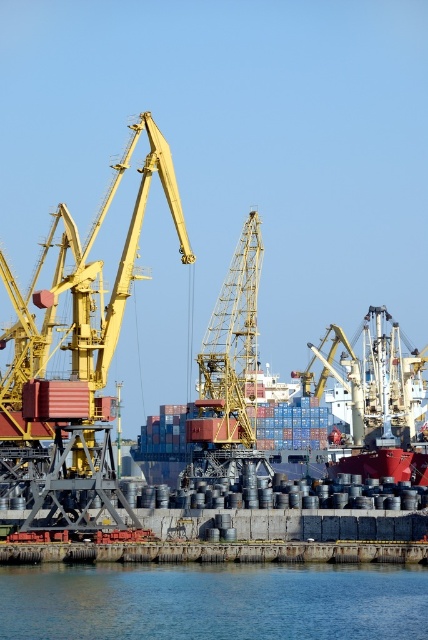
How distant is blue liquid water at lower center from yellow metallic crane at center?

They are 99.69 meters apart.

Who is taller, blue liquid water at lower center or yellow metallic crane at center?

yellow metallic crane at center is taller.

You are a GUI agent. You are given a task and a screenshot of the screen. Output one action in this format:
    pyautogui.click(x=<x>, y=<y>)
    Task: Click on the blue liquid water at lower center
    This screenshot has height=640, width=428.
    Given the screenshot: What is the action you would take?
    click(x=213, y=602)

Who is more distant from viewer, (397, 408) or (199, 388)?

Point (397, 408)

Can you confirm if red matte container ship at center is taller than yellow metallic crane at center?

No, red matte container ship at center is not taller than yellow metallic crane at center.

Which is in front, point (184, 436) or point (250, 269)?

Point (250, 269) is more forward.

Where is `red matte container ship at center`? red matte container ship at center is located at coordinates (385, 404).

Which is behind, point (416, 579) or point (362, 406)?

The point (362, 406) is more distant.

Is blue liquid water at lower center above red matte container ship at center?

Actually, blue liquid water at lower center is below red matte container ship at center.

Where is `blue liquid water at lower center`? The width and height of the screenshot is (428, 640). blue liquid water at lower center is located at coordinates (213, 602).